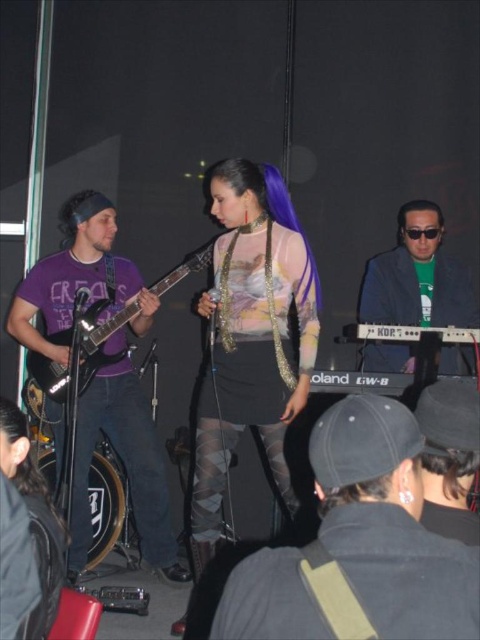
You are a photographer at the back of the stage. You want to take a photo of the dark brown silky hair at center and the green matte keyboard at center. Which object will be more visible in your photo?

The green matte keyboard at center is positioned over dark brown silky hair at center, so the green matte keyboard at center will be more visible in the photo.

You are a stagehand who needs to adjust the microphone stand between the matte purple shirt at left and the matte black electric guitar at left. The stand requires 10 inches of space. Is there enough space between them?

The distance between the matte purple shirt at left and the matte black electric guitar at left is 9.00 inches, which is less than the required 10 inches. Therefore, there isn not enough space to place the microphone stand between them.